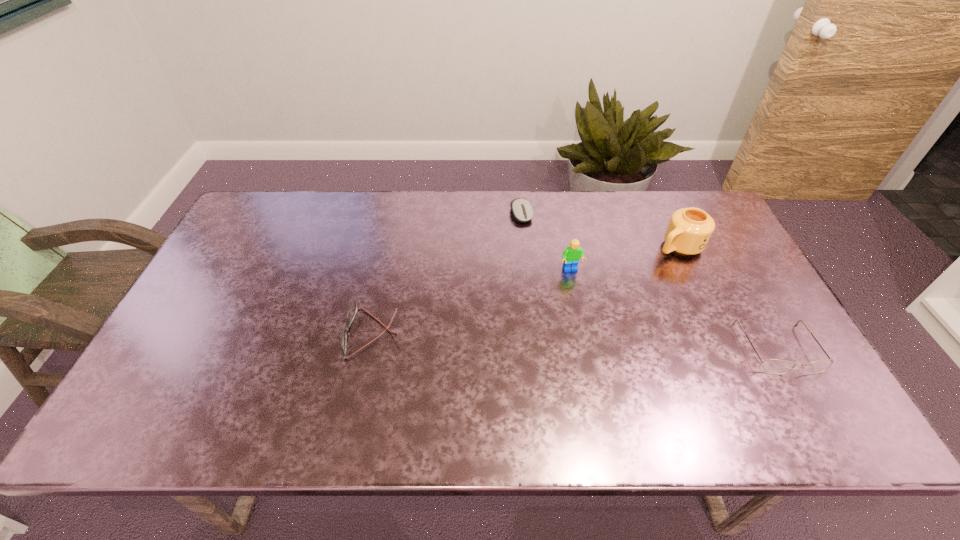
Where is `vacant region at the far left corner`? The width and height of the screenshot is (960, 540). vacant region at the far left corner is located at coordinates (290, 191).

This screenshot has height=540, width=960. What are the coordinates of `free space at the far right corner` in the screenshot? It's located at (678, 210).

Locate an element on the screen. Image resolution: width=960 pixels, height=540 pixels. free space between the mug and the left spectacles is located at coordinates (526, 290).

Where is `free space between the left spectacles and the second farthest object`? The width and height of the screenshot is (960, 540). free space between the left spectacles and the second farthest object is located at coordinates (526, 290).

This screenshot has width=960, height=540. I want to click on free space between the third object from left to right and the computer equipment, so click(x=546, y=242).

Locate an element on the screen. The height and width of the screenshot is (540, 960). vacant area that lies between the leftmost object and the fourth nearest object is located at coordinates (526, 290).

Locate an element on the screen. vacant space in between the right spectacles and the fourth nearest object is located at coordinates (729, 298).

Identify the location of blank region between the right spectacles and the computer equipment. This screenshot has height=540, width=960. (650, 281).

Image resolution: width=960 pixels, height=540 pixels. Identify the location of free space that is in between the leftmost object and the third nearest object. 472,302.

Where is `vacant area that lies between the right spectacles and the third nearest object`? vacant area that lies between the right spectacles and the third nearest object is located at coordinates (675, 309).